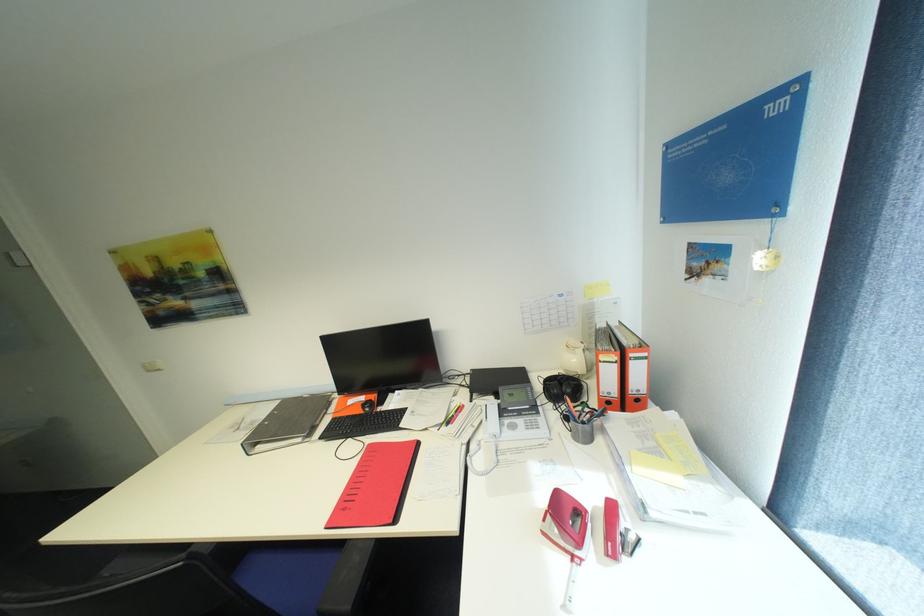
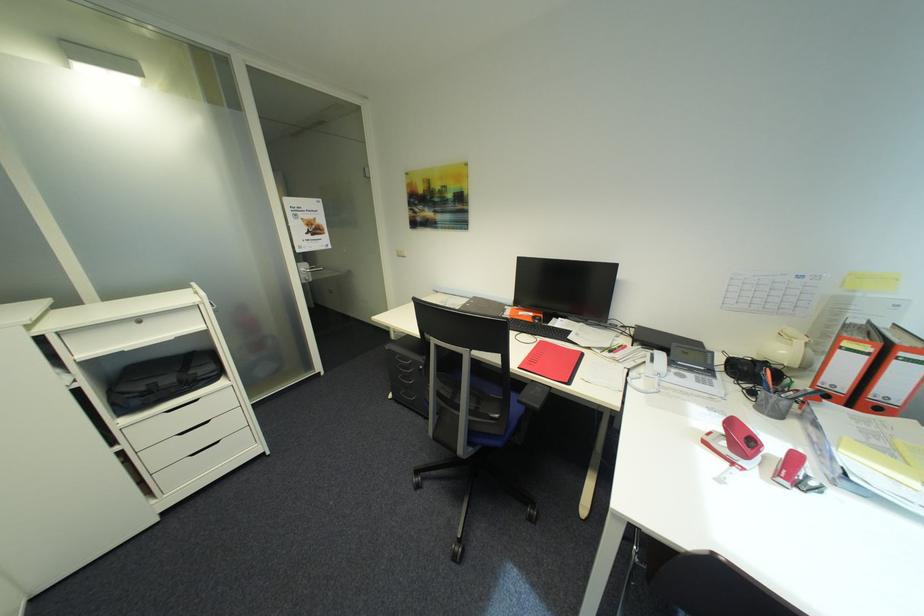
Question: I am providing you with two images of the same scene from different viewpoints. Which of the following objects are not visible in image2?

Choices:
 (A) telephone handset
 (B) drawer lock
 (C) white drawer handle
 (D) none of these

Answer: (D)